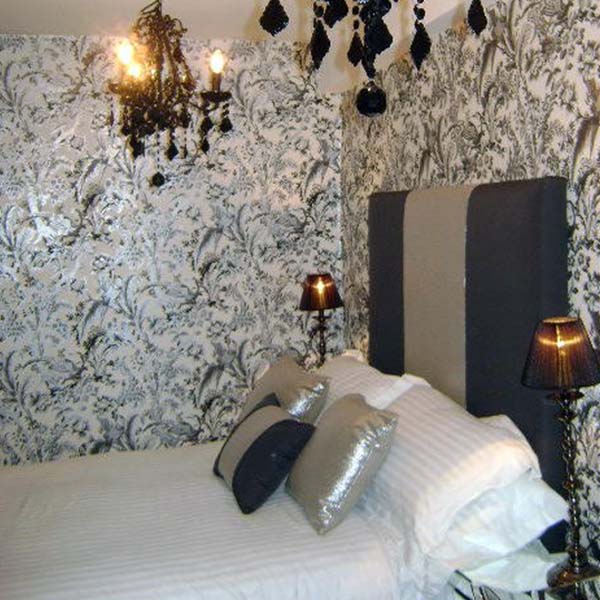
Identify the location of lamp. (574, 568).